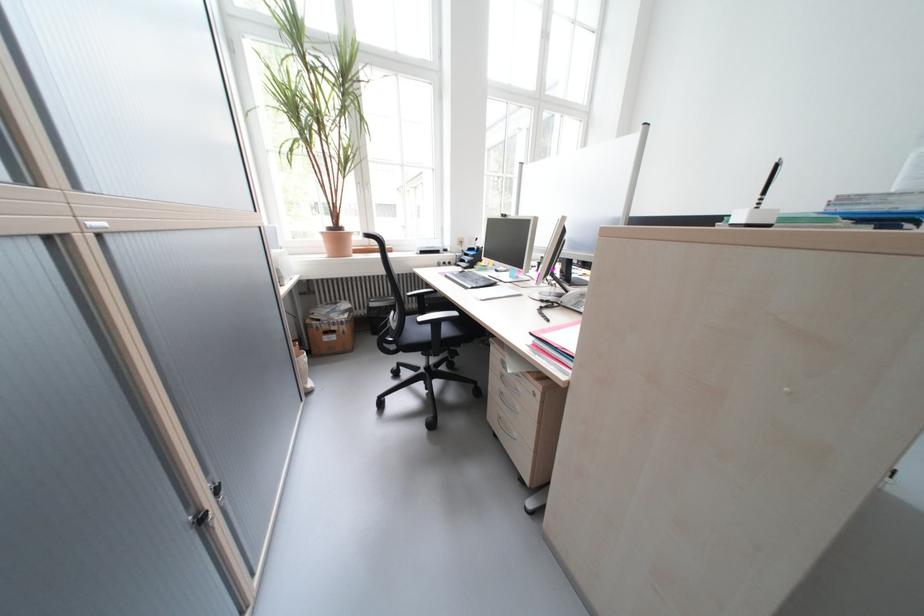
Where would you lift the telephone handset? Please return your answer as a coordinate pair (x, y).

(574, 299)